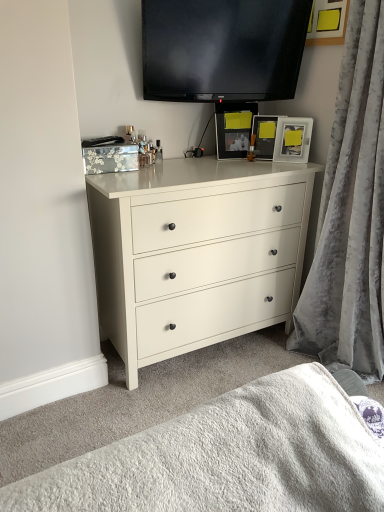
Question: Is matte silver picture frame at upper right, the first picture frame from the right, inside the boundaries of flat screen tv at upper center, or outside?

Choices:
 (A) outside
 (B) inside

Answer: (A)

Question: From a real-world perspective, is matte silver picture frame at upper right, the first picture frame from the right, physically located above or below flat screen tv at upper center?

Choices:
 (A) above
 (B) below

Answer: (B)

Question: Which of these objects is positioned farthest from the flat screen tv at upper center?

Choices:
 (A) white matte chest of drawers at center
 (B) velvet gray curtain at right
 (C) white textured blanket at lower center
 (D) matte silver picture frame at upper right, the first picture frame from the right
 (E) matte black picture frame at center, which is the second picture frame in right-to-left order

Answer: (C)

Question: Which is nearer to the flat screen tv at upper center?

Choices:
 (A) matte silver picture frame at upper right, the second picture frame from the left
 (B) velvet gray curtain at right
 (C) matte black picture frame at center, which is the second picture frame in right-to-left order
 (D) white matte chest of drawers at center
 (E) white textured blanket at lower center

Answer: (C)